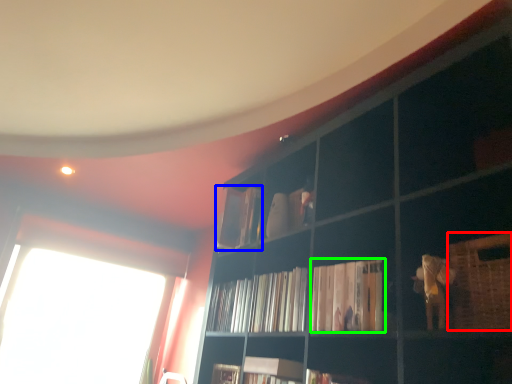
Question: Which is nearer to the basket (highlighted by a red box)? book (highlighted by a blue box) or book (highlighted by a green box).

Choices:
 (A) book
 (B) book

Answer: (B)